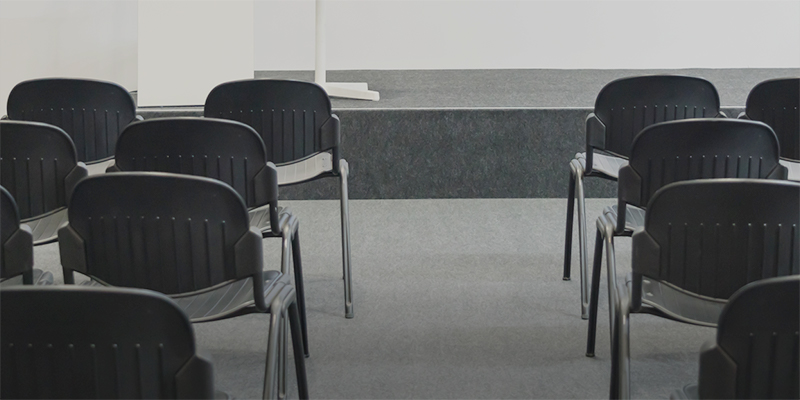
Locate an element on the screen. Image resolution: width=800 pixels, height=400 pixels. chair seats is located at coordinates (309, 169), (266, 222), (228, 304), (42, 232), (44, 275), (597, 155), (632, 222), (654, 298), (796, 173), (104, 166).